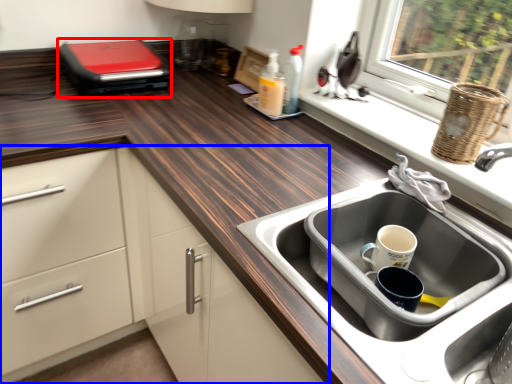
Question: Among these objects, which one is nearest to the camera, appliance (highlighted by a red box) or cabinetry (highlighted by a blue box)?

Choices:
 (A) appliance
 (B) cabinetry

Answer: (B)